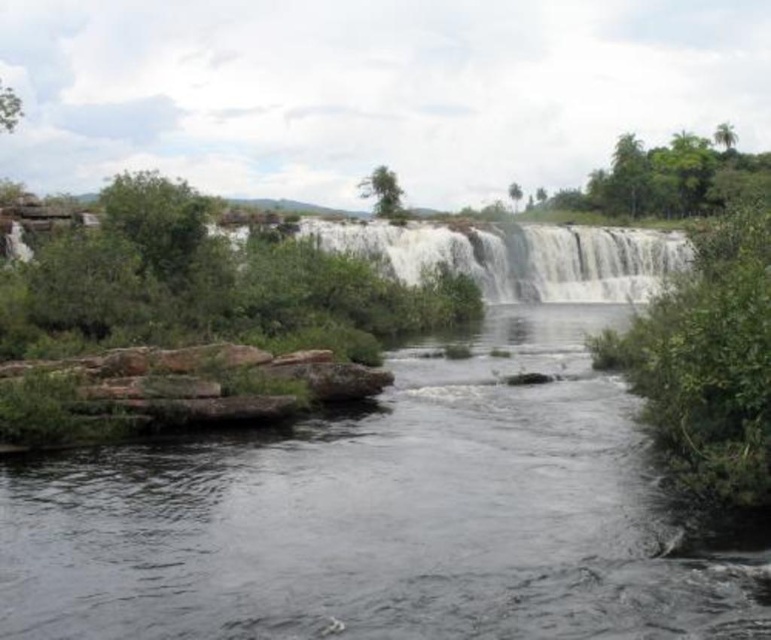
You are standing at the base of the waterfall and want to reach the point marked as point (147, 609). There is another point, point (605, 248), in your path. Which point should you avoid stepping on to stay closer to the waterfall?

You should avoid stepping on point (605, 248) because point (147, 609) is in front of it, meaning the latter is closer to the waterfall base. Stepping on point (605, 248) would take you further away from your target.

You are a photographer planning to capture the waterfall scene. You want to focus on the clear water at center without the white textured water at center overlapping in the foreground. Is this possible based on the scene description?

The clear water at center is in front of the white textured water at center, so it would block the view of the white textured water at center. Therefore, you can focus on the clear water at center without the white textured water at center overlapping in the foreground.

You are standing at the camera position and want to reach the point marked at coordinates point (416, 355). Given that you can walk 10 meters per minute, how many minutes will it take you to reach that point?

The point marked at coordinates point (416, 355) is 60.29 meters away from the camera. At a walking speed of 10 meters per minute, it would take approximately 6.029 minutes to reach the point.